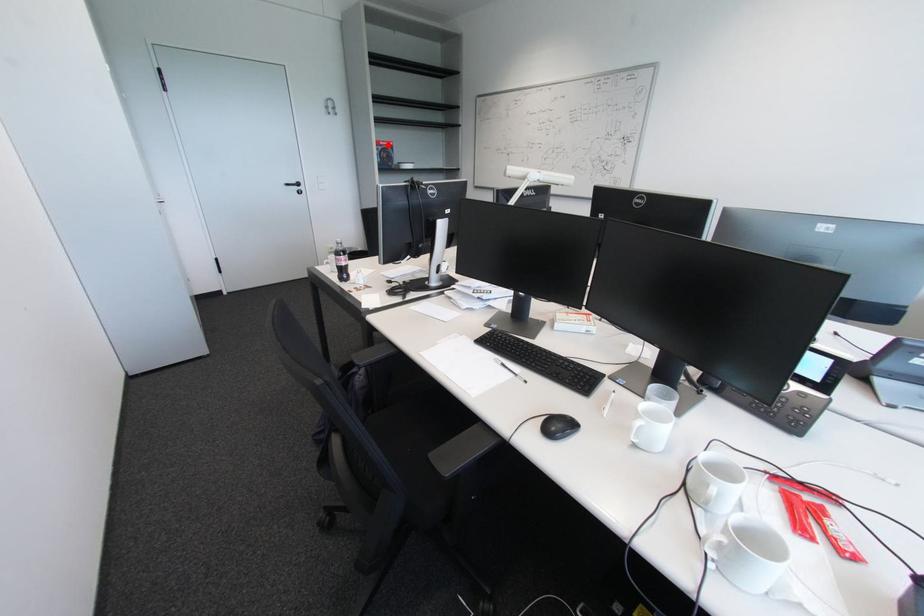
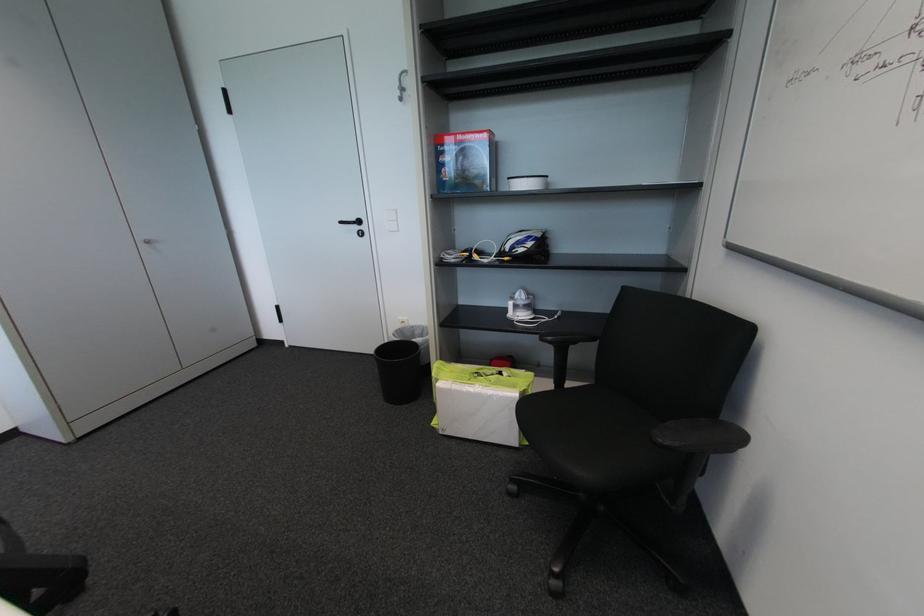
The point at the highlighted location is marked in the first image. Where is the corresponding point in the second image?

(466, 139)